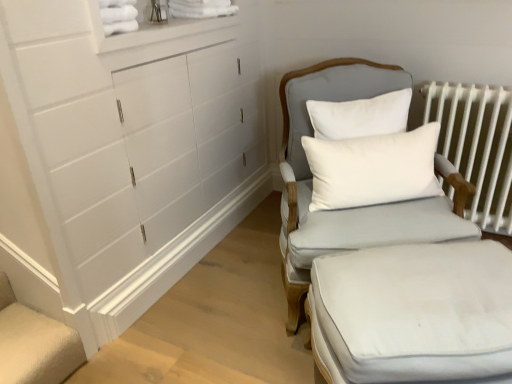
Locate an element on the screen. This screenshot has width=512, height=384. free spot to the left of light gray fabric chair at center-right is located at coordinates (228, 292).